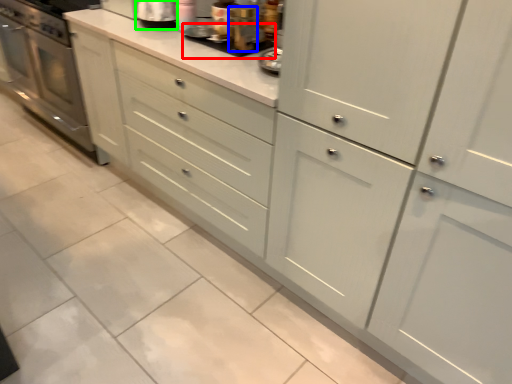
Question: Which is farther away from appliance (highlighted by a red box)? appliance (highlighted by a blue box) or appliance (highlighted by a green box)?

Choices:
 (A) appliance
 (B) appliance

Answer: (B)